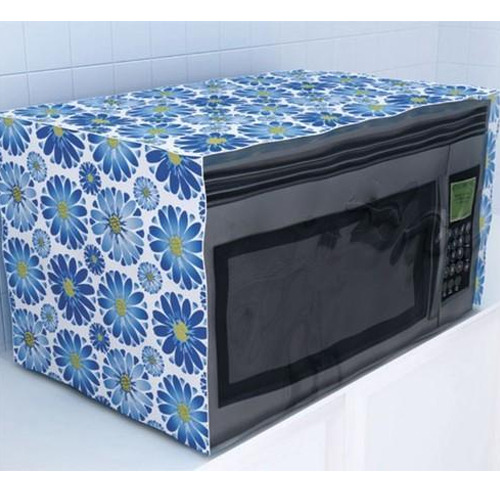
Locate an element on the screen. The image size is (500, 500). the top of microwave is located at coordinates (269, 102).